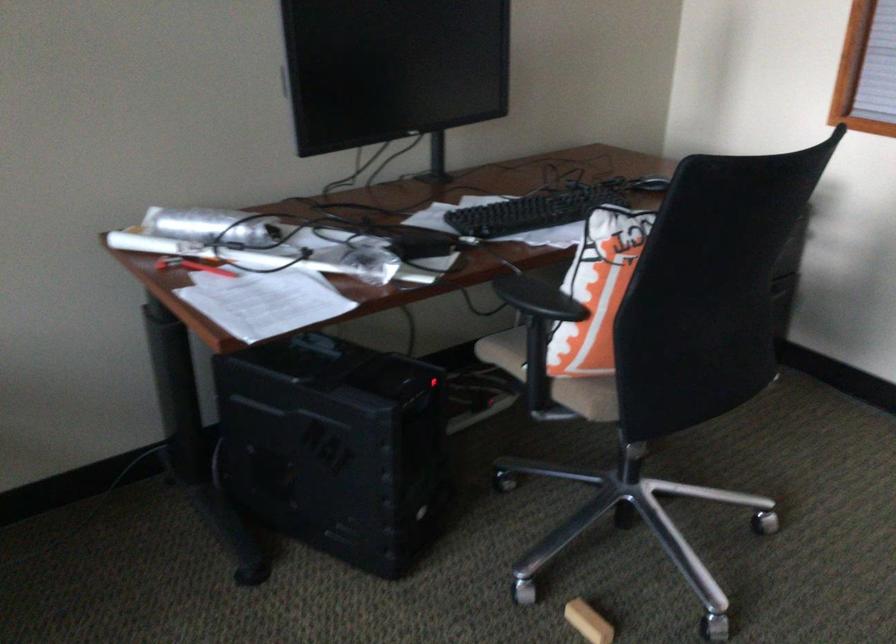
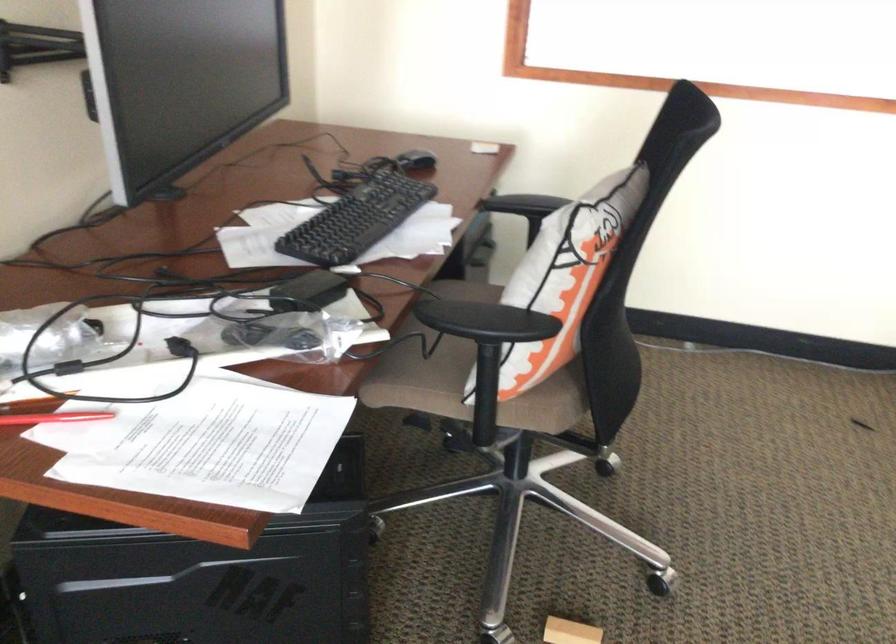
Locate, in the second image, the point that corresponds to point (645, 182) in the first image.

(416, 162)